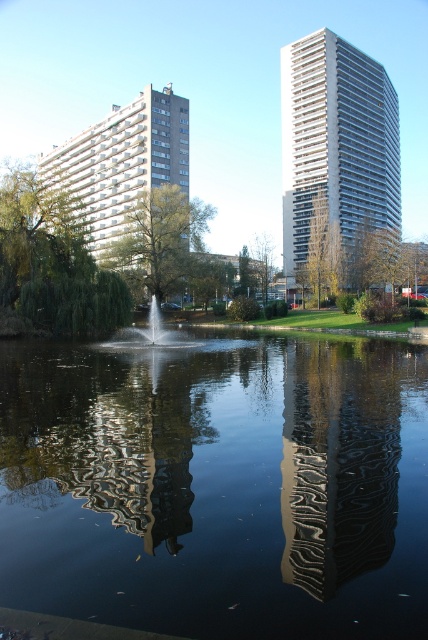
This screenshot has width=428, height=640. Describe the element at coordinates (217, 484) in the screenshot. I see `smooth reflective water at center` at that location.

How far apart are smooth reflective water at center and white textured building at left?

smooth reflective water at center and white textured building at left are 77.10 meters apart from each other.

At what (x,y) coordinates should I click in order to perform the action: click on smooth reflective water at center. Please return your answer as a coordinate pair (x, y). Image resolution: width=428 pixels, height=640 pixels. Looking at the image, I should click on (217, 484).

The height and width of the screenshot is (640, 428). What are the coordinates of `smooth reflective water at center` in the screenshot? It's located at (217, 484).

Measure the distance between smooth reflective water at center and camera.

A distance of 3.16 meters exists between smooth reflective water at center and camera.

Does smooth reflective water at center come behind white glossy fountain at center?

No, it is not.

Identify the location of smooth reflective water at center. (217, 484).

Who is positioned more to the left, glossy metallic building at center or white glossy building at upper center?

Positioned to the left is glossy metallic building at center.

Does point (323, 589) lie in front of point (362, 97)?

Yes, point (323, 589) is closer to viewer.

Does point (383, 388) lie in front of point (359, 196)?

Yes, it is.

I want to click on glossy metallic building at center, so click(338, 467).